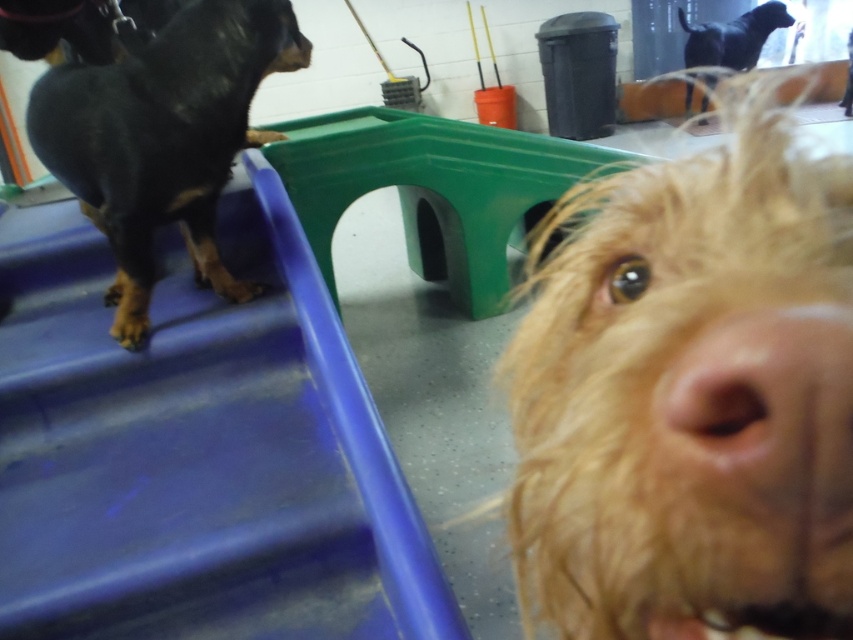
You are a groomer holding a 10 inch long grooming tool. You want to reach the wet golden fur at center to dry it. Is the tool long enough to reach the fur without moving closer?

The wet golden fur at center is 8.17 inches away from the viewer. Since the grooming tool is 10 inches long, it is longer than the distance required. Therefore, the tool is long enough to reach the wet golden fur at center without needing to move closer.

Where is the black smooth dog at left located in the image?

The black smooth dog at left is located at point 0.217 on the x axis and 0.192 on the y axis.

You are a photographer setting up a shot of the two points in the image. Which point, point (x=141, y=205) or point (x=712, y=35), is closer to the camera?

Point (x=141, y=205) is closer to the camera than point (x=712, y=35).